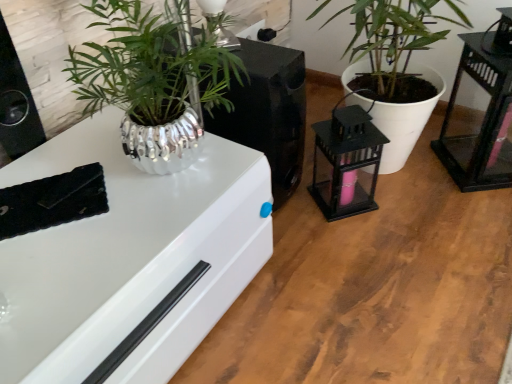
Find the location of a particular element. The height and width of the screenshot is (384, 512). vacant area in front of black glass table at right is located at coordinates (476, 213).